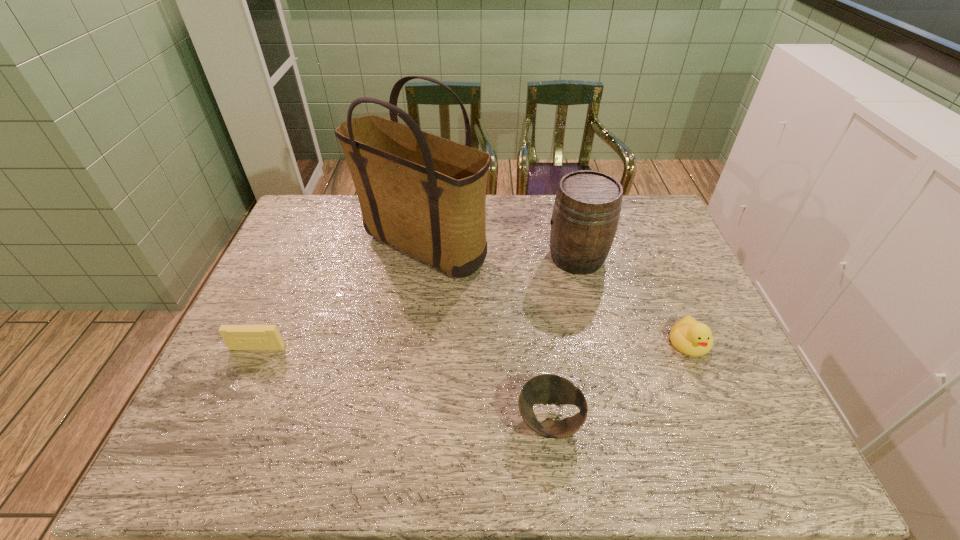
You are a GUI agent. You are given a task and a screenshot of the screen. Output one action in this format:
    pyautogui.click(x=<x>, y=<y>)
    Task: Click on the vacant region between the nearest object and the videotape
    This screenshot has height=540, width=960.
    Given the screenshot: What is the action you would take?
    pyautogui.click(x=403, y=384)

You are a GUI agent. You are given a task and a screenshot of the screen. Output one action in this format:
    pyautogui.click(x=<x>, y=<y>)
    Task: Click on the vacant space that's between the bowl and the second tallest object
    
    Given the screenshot: What is the action you would take?
    pyautogui.click(x=564, y=339)

Where is `vacant point located between the videotape and the rightmost object`? The height and width of the screenshot is (540, 960). vacant point located between the videotape and the rightmost object is located at coordinates (473, 345).

The width and height of the screenshot is (960, 540). I want to click on object that is the fourth closest one to the tallest object, so (688, 336).

Identify which object is the nearest to the rightmost object. Please provide its 2D coordinates. Your answer should be formatted as a tuple, i.e. [(x, y)], where the tuple contains the x and y coordinates of a point satisfying the conditions above.

[(586, 211)]

Locate an element on the screen. This screenshot has width=960, height=540. free space that satisfies the following two spatial constraints: 1. at the front of the bowl with spools; 2. on the right side of the videotape is located at coordinates (225, 421).

You are a GUI agent. You are given a task and a screenshot of the screen. Output one action in this format:
    pyautogui.click(x=<x>, y=<y>)
    Task: Click on the free location that satisfies the following two spatial constraints: 1. on the side of the second tallest object near the bung hole; 2. at the front of the videotape with spools
    The image size is (960, 540).
    Given the screenshot: What is the action you would take?
    pyautogui.click(x=598, y=348)

At what (x,y) coordinates should I click in order to perform the action: click on vacant space that satisfies the following two spatial constraints: 1. at the front of the leftmost object with spools; 2. on the right side of the nearest object. Please return your answer as a coordinate pair (x, y). Looking at the image, I should click on (225, 421).

Identify the location of blank space that satisfies the following two spatial constraints: 1. on the side of the cider near the bung hole; 2. on the front side of the bowl. The image size is (960, 540). pos(615,421).